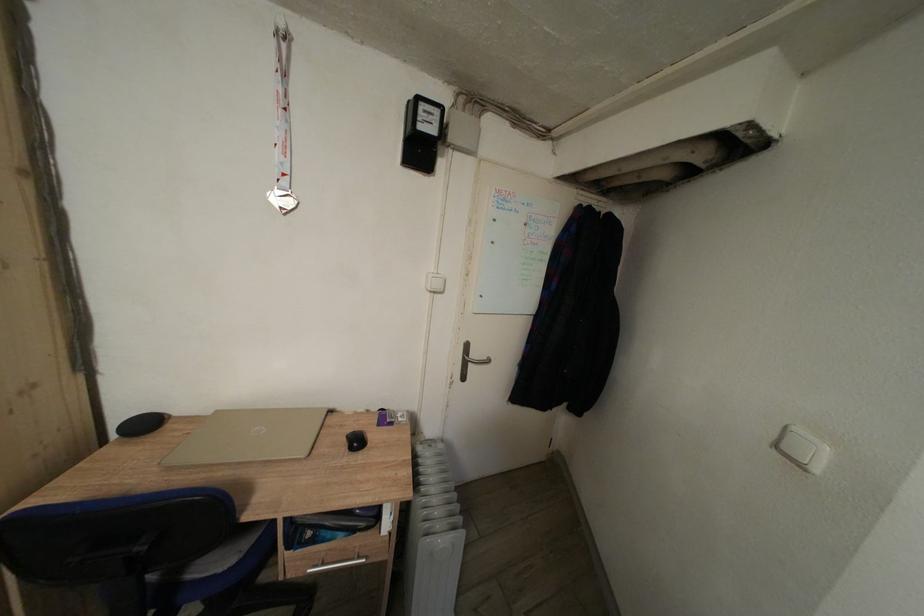
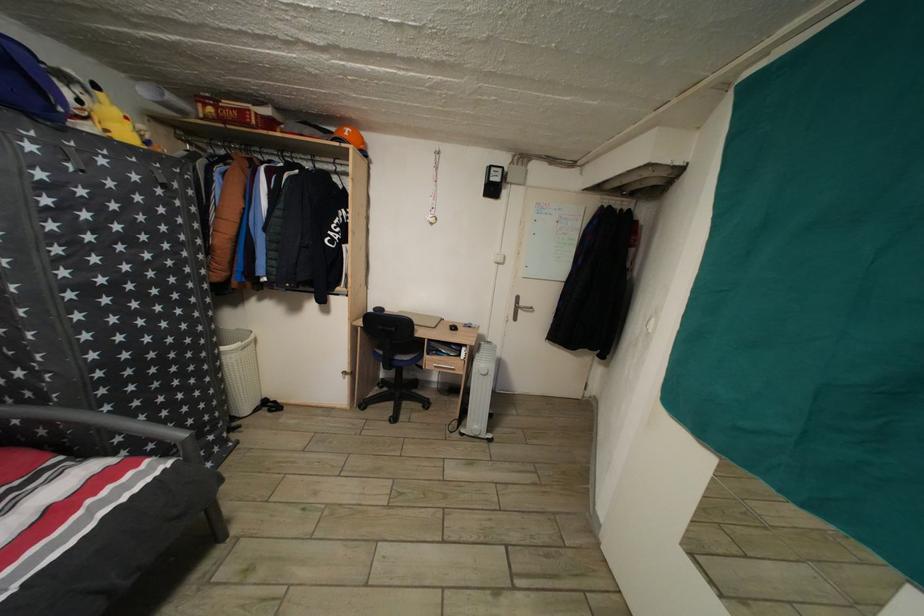
Where in the second image is the point corresponding to the point at 321,548 from the first image?

(443, 361)